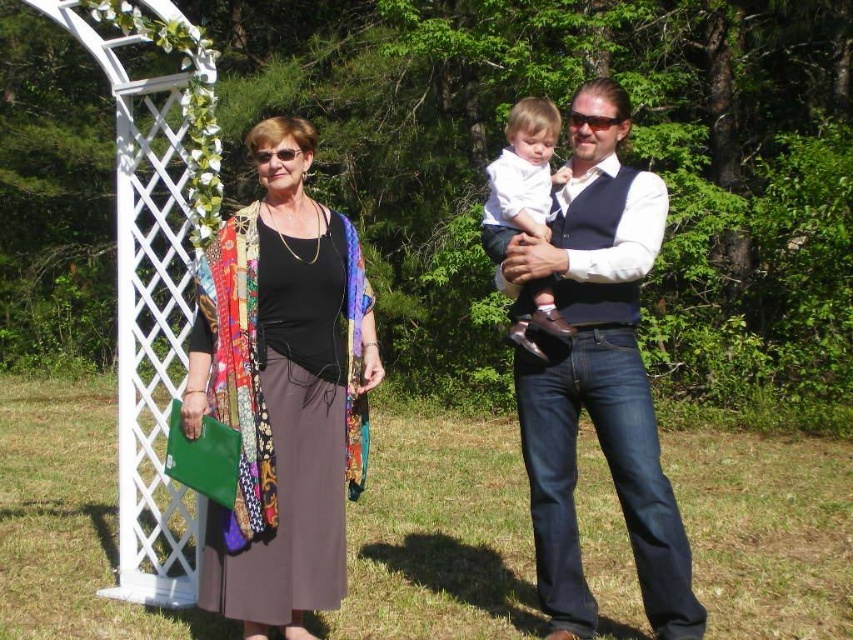
Is matte white shirt at center to the left of white soft fabric baby at center from the viewer's perspective?

In fact, matte white shirt at center is to the right of white soft fabric baby at center.

Who is positioned more to the left, matte white shirt at center or white soft fabric baby at center?

Positioned to the left is white soft fabric baby at center.

Who is more distant from viewer, (610, 100) or (515, 180)?

Positioned behind is point (515, 180).

You are a GUI agent. You are given a task and a screenshot of the screen. Output one action in this format:
    pyautogui.click(x=<x>, y=<y>)
    Task: Click on the matte white shirt at center
    This screenshot has height=640, width=853.
    Given the screenshot: What is the action you would take?
    pyautogui.click(x=598, y=376)

Which is more to the right, multicolored fabric shawl at left or white soft fabric baby at center?

white soft fabric baby at center

Does point (311, 352) come in front of point (538, 134)?

Yes, it is in front of point (538, 134).

Is point (230, 248) closer to camera compared to point (492, 256)?

Yes, it is in front of point (492, 256).

The width and height of the screenshot is (853, 640). I want to click on multicolored fabric shawl at left, so click(x=283, y=392).

How far apart are multicolored fabric shawl at left and matte white shirt at center?

A distance of 1.18 meters exists between multicolored fabric shawl at left and matte white shirt at center.

Consider the image. Is multicolored fabric shawl at left smaller than matte white shirt at center?

Incorrect, multicolored fabric shawl at left is not smaller in size than matte white shirt at center.

Between point (247, 516) and point (587, 115), which one is positioned in front?

Point (247, 516)

Where is `multicolored fabric shawl at left`? The width and height of the screenshot is (853, 640). multicolored fabric shawl at left is located at coordinates (283, 392).